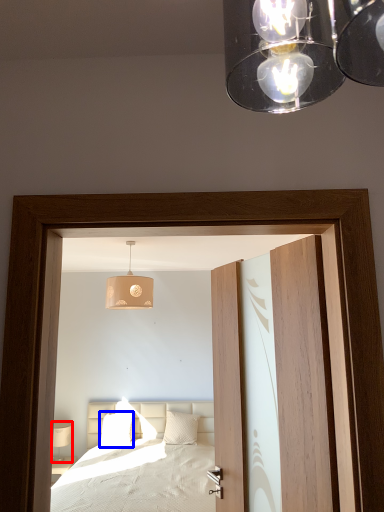
Question: Which object is further to the camera taking this photo, table lamp (highlighted by a red box) or pillow (highlighted by a blue box)?

Choices:
 (A) table lamp
 (B) pillow

Answer: (A)